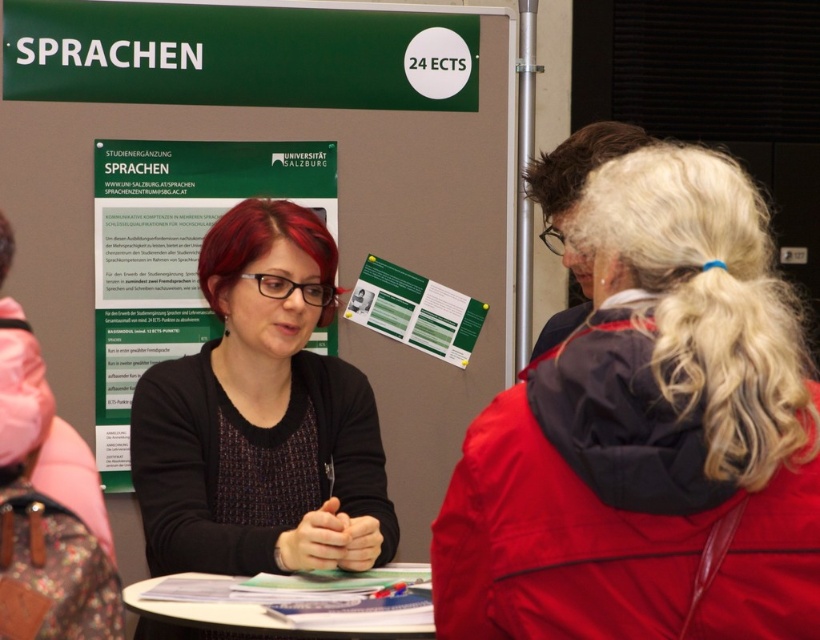
Who is taller, matte black sweater at center or green paper at center?

matte black sweater at center is taller.

Can you confirm if matte black sweater at center is wider than green paper at center?

Yes.

Is point (239, 538) farther from camera compared to point (474, 317)?

No, it is in front of (474, 317).

The height and width of the screenshot is (640, 820). What are the coordinates of `matte black sweater at center` in the screenshot? It's located at (262, 417).

Can you confirm if dark blue jacket at center is positioned below green paper at center?

Correct, dark blue jacket at center is located below green paper at center.

Is dark blue jacket at center taller than green paper at center?

Yes.

I want to click on dark blue jacket at center, so click(647, 436).

Does green cardboard poster at center have a smaller size compared to white paper at center?

No, green cardboard poster at center is not smaller than white paper at center.

In the scene shown: Which is below, green cardboard poster at center or white paper at center?

white paper at center is below.

You are a GUI agent. You are given a task and a screenshot of the screen. Output one action in this format:
    pyautogui.click(x=<x>, y=<y>)
    Task: Click on the green cardboard poster at center
    
    Given the screenshot: What is the action you would take?
    pyautogui.click(x=247, y=196)